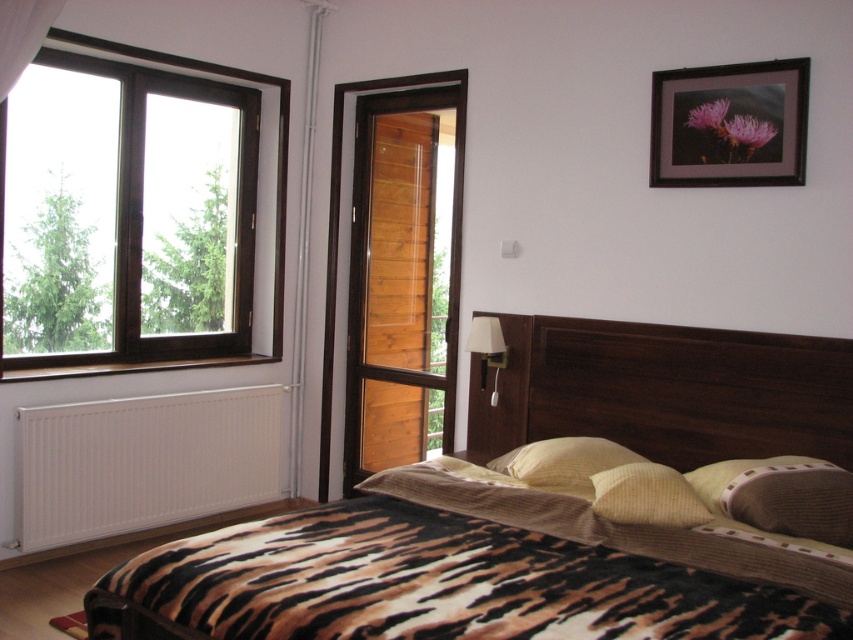
This screenshot has height=640, width=853. Describe the element at coordinates (142, 461) in the screenshot. I see `white matte radiator at lower left` at that location.

Locate an element on the screen. The height and width of the screenshot is (640, 853). white matte radiator at lower left is located at coordinates click(x=142, y=461).

You are a GUI agent. You are given a task and a screenshot of the screen. Output one action in this format:
    pyautogui.click(x=<x>, y=<y>)
    Task: Click on the white matte radiator at lower left
    Image resolution: width=853 pixels, height=640 pixels.
    Given the screenshot: What is the action you would take?
    pyautogui.click(x=142, y=461)

Which is below, dark wood headboard at center or brown textured pillow at lower right?

Positioned lower is brown textured pillow at lower right.

Is point (614, 346) farther from viewer compared to point (727, 481)?

Yes, point (614, 346) is behind point (727, 481).

Identify the location of dark wood headboard at center. (664, 390).

In the scene shown: Is brown wooden window at upper left closer to the viewer compared to yellow checkered pillow at center?

No, brown wooden window at upper left is further to the viewer.

Between point (258, 330) and point (566, 474), which one is positioned behind?

Positioned behind is point (258, 330).

Where is `brown wooden window at upper left`? brown wooden window at upper left is located at coordinates (263, 204).